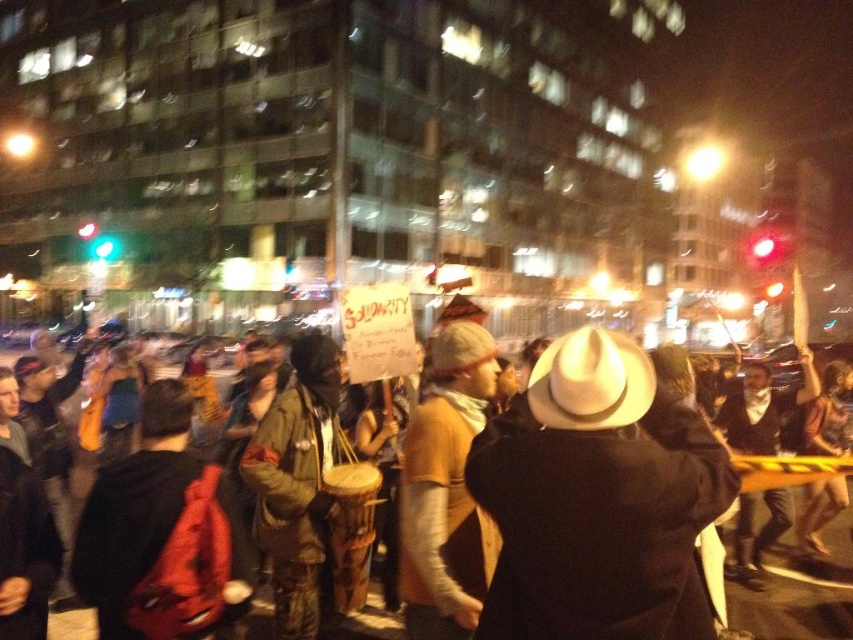
Question: Does white matte hat at center appear on the right side of brown leather jacket at center?

Choices:
 (A) yes
 (B) no

Answer: (B)

Question: Which point appears farthest from the camera in this image?

Choices:
 (A) [x=585, y=476]
 (B) [x=375, y=609]

Answer: (B)

Question: Is white matte hat at center closer to camera compared to brown leather jacket at center?

Choices:
 (A) no
 (B) yes

Answer: (B)

Question: Is white matte hat at center positioned behind brown leather jacket at center?

Choices:
 (A) no
 (B) yes

Answer: (A)

Question: Among these points, which one is farthest from the camera?

Choices:
 (A) 761,630
 (B) 518,637

Answer: (A)